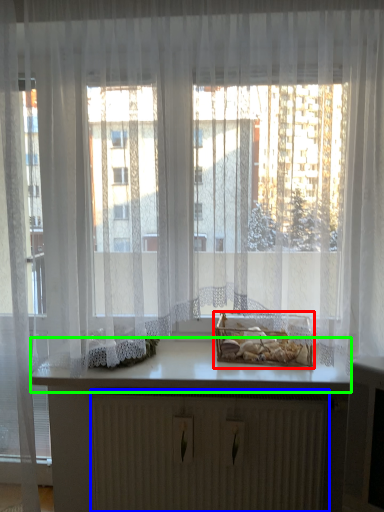
Question: Based on their relative distances, which object is farther from window box (highlighted by a red box)? Choose from radiator (highlighted by a blue box) and counter top (highlighted by a green box).

Choices:
 (A) radiator
 (B) counter top

Answer: (A)